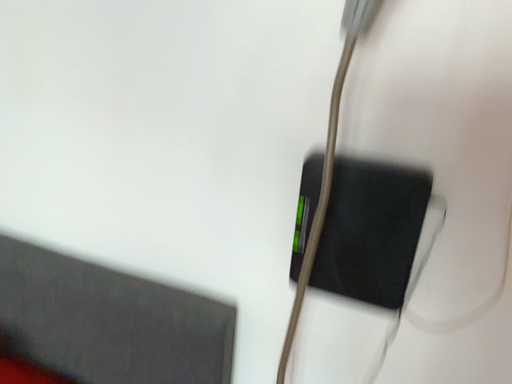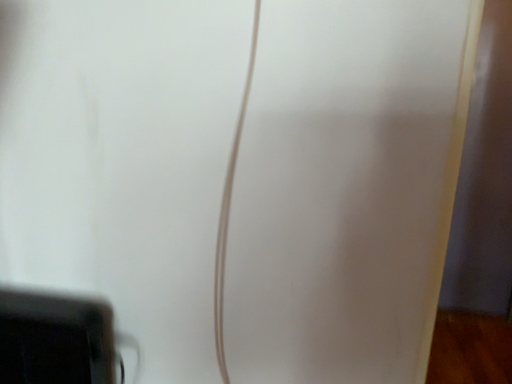
Question: How did the camera likely rotate when shooting the video?

Choices:
 (A) rotated upward
 (B) rotated downward

Answer: (A)